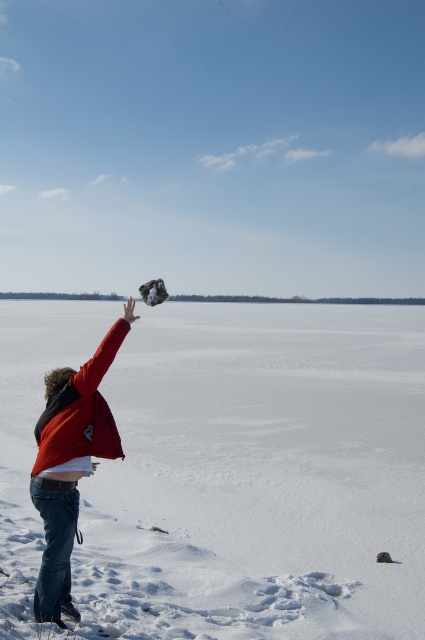
You are a drone operator trying to capture a photo of the red cotton jacket at center and the white fluffy snow at upper center. Your drone can only maintain a stable shot if the distance between the two objects is at least 60 feet. Based on the scene, will the drone be able to capture a stable shot?

The distance between the white fluffy snow at upper center and red cotton jacket at center is 68.09 feet, which exceeds the minimum requirement of 60 feet. Therefore, the drone can maintain a stable shot.

You are standing in the winter scene and see two points marked in the image. Which point is closer to you, point (226, 566) or point (56, 486)?

Point (56, 486) is closer to you because the Objects Description states that point (226, 566) is further to the viewer than point (56, 486).

You are a photographer trying to capture the scene with the white fluffy snow at upper center and the red cotton jacket at center. Which object should you focus on first if you want to ensure both are in focus?

You should focus on the red cotton jacket at center first because it is closer to you than the white fluffy snow at upper center, which is further away. By focusing on the closer object, the background object will also be in focus due to the depth of field.